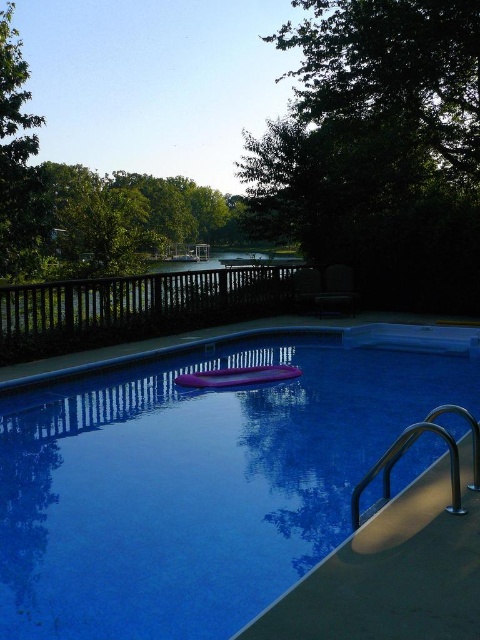
Question: Does green leafy tree at upper right appear on the right side of brown wooden rail at upper center?

Choices:
 (A) yes
 (B) no

Answer: (A)

Question: Based on their relative distances, which object is nearer to the metallic silver handrail at lower right?

Choices:
 (A) glossy plastic pool at center
 (B) purple rubber mat at center
 (C) green leafy tree at upper right

Answer: (A)

Question: Is brown wooden rail at upper center closer to camera compared to purple rubber mat at center?

Choices:
 (A) yes
 (B) no

Answer: (B)

Question: Which object is positioned closest to the metallic silver handrail at lower right?

Choices:
 (A) satin silver rail at lower right
 (B) brown wooden rail at upper center
 (C) glossy plastic pool at center
 (D) purple rubber mat at center

Answer: (A)

Question: Does green leafy tree at upper right have a lesser width compared to satin silver rail at lower right?

Choices:
 (A) no
 (B) yes

Answer: (A)

Question: Which object is the farthest from the brown wooden rail at upper center?

Choices:
 (A) green leafy tree at upper right
 (B) satin silver rail at lower right

Answer: (A)